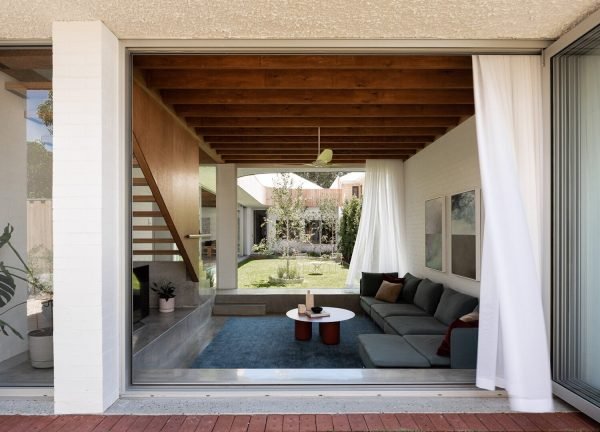
You are a GUI agent. You are given a task and a screenshot of the screen. Output one action in this format:
    pyautogui.click(x=<x>, y=<y>)
    Task: Click on the planter
    Image resolution: width=600 pixels, height=432 pixels.
    Given the screenshot: What is the action you would take?
    pyautogui.click(x=170, y=304), pyautogui.click(x=46, y=347)